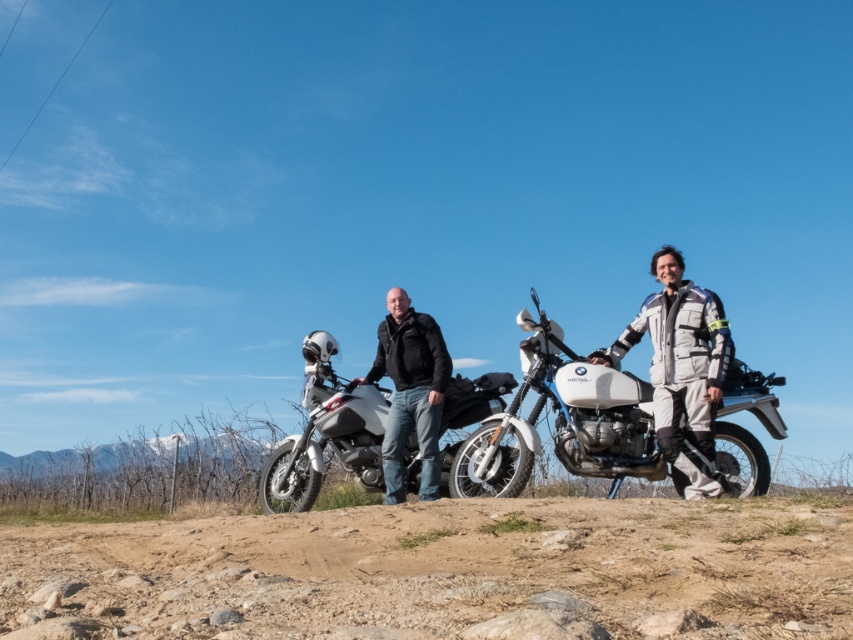
From the picture: You are planning to set up a small picnic area in the open, rural setting shown. You want to place a picnic blanket on the dusty brown soil at lower center and a cooler on the white matte adventure bike at center. Which surface will require more space for placement?

The white matte adventure bike at center requires more space because the dusty brown soil at lower center has a smaller size compared to it.

You are planning to transport both the white matte motorcycle at center and the gray textured jacket at center into a storage unit. The storage unit has a width limit of 2 meters. Given that the motorcycle is wider than the jacket, can both items fit side by side within the storage unit?

The white matte motorcycle at center is wider than the gray textured jacket at center. However, since the exact widths are not provided, it is impossible to determine if both can fit within the 2 meter width limit of the storage unit.